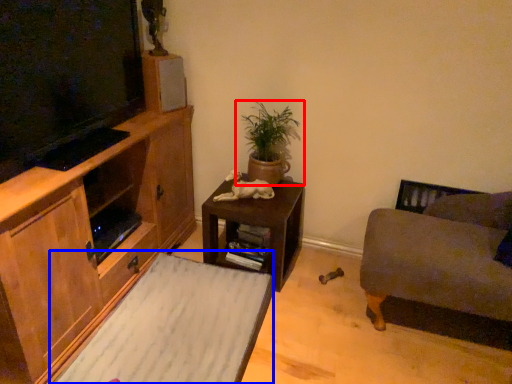
Question: Which point is closer to the camera, houseplant (highlighted by a red box) or plain (highlighted by a blue box)?

Choices:
 (A) houseplant
 (B) plain

Answer: (B)